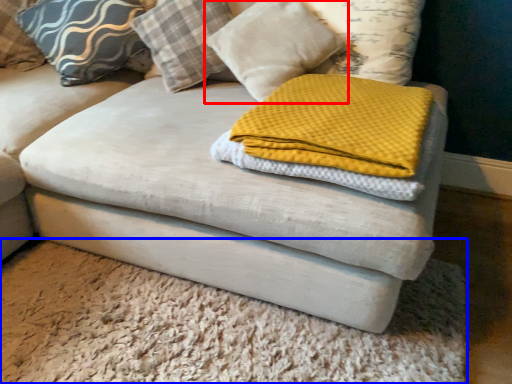
Question: Among these objects, which one is nearest to the camera, pillow (highlighted by a red box) or mat (highlighted by a blue box)?

Choices:
 (A) pillow
 (B) mat

Answer: (B)